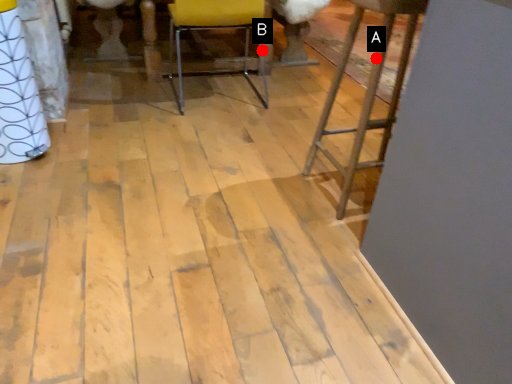
Question: Two points are circled on the image, labeled by A and B beside each circle. Which point appears farthest from the camera in this image?

Choices:
 (A) A is further
 (B) B is further

Answer: (B)